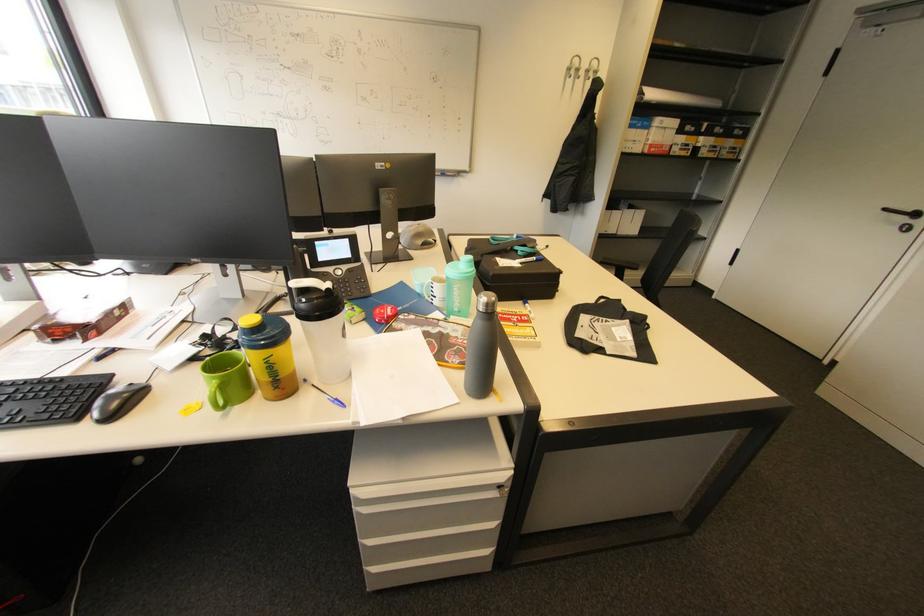
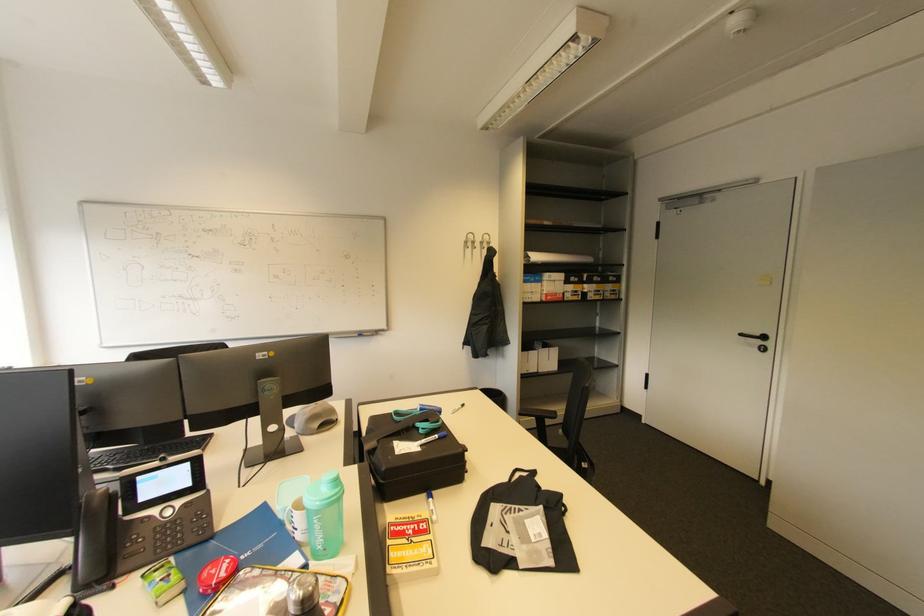
In the second image, find the point that corresponds to (574,70) in the first image.

(470, 243)